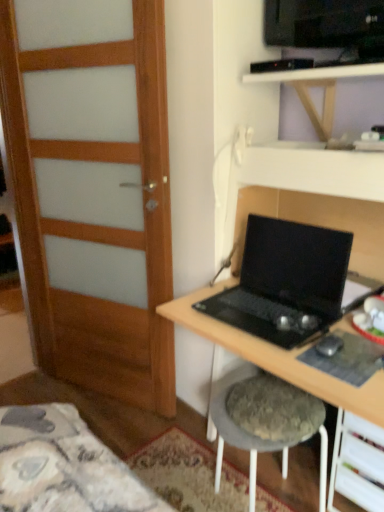
Question: Is fuzzy fabric stool at lower center looking in the opposite direction of black matte desk at center?

Choices:
 (A) no
 (B) yes

Answer: (B)

Question: Considering the relative sizes of fuzzy fabric stool at lower center and black matte desk at center in the image provided, is fuzzy fabric stool at lower center shorter than black matte desk at center?

Choices:
 (A) yes
 (B) no

Answer: (A)

Question: Can you confirm if fuzzy fabric stool at lower center is positioned to the right of black matte desk at center?

Choices:
 (A) no
 (B) yes

Answer: (A)

Question: Considering the relative sizes of fuzzy fabric stool at lower center and black matte desk at center in the image provided, is fuzzy fabric stool at lower center bigger than black matte desk at center?

Choices:
 (A) yes
 (B) no

Answer: (B)

Question: Does fuzzy fabric stool at lower center contain black matte desk at center?

Choices:
 (A) no
 (B) yes

Answer: (A)

Question: From a real-world perspective, relative to wooden door at left, is black matte desk at center vertically above or below?

Choices:
 (A) above
 (B) below

Answer: (B)

Question: Considering the positions of black matte desk at center and wooden door at left in the image, is black matte desk at center bigger or smaller than wooden door at left?

Choices:
 (A) small
 (B) big

Answer: (B)

Question: Considering the positions of point (311, 387) and point (132, 206), is point (311, 387) closer or farther from the camera than point (132, 206)?

Choices:
 (A) farther
 (B) closer

Answer: (B)

Question: Is black matte desk at center taller or shorter than wooden door at left?

Choices:
 (A) short
 (B) tall

Answer: (A)

Question: Relative to white plastic drawer at lower right, is black matte desk at center in front or behind?

Choices:
 (A) behind
 (B) front

Answer: (B)

Question: Looking at their shapes, would you say black matte desk at center is wider or thinner than white plastic drawer at lower right?

Choices:
 (A) wide
 (B) thin

Answer: (A)

Question: Looking at the image, does black matte desk at center seem bigger or smaller compared to white plastic drawer at lower right?

Choices:
 (A) big
 (B) small

Answer: (A)

Question: From the image's perspective, is black matte desk at center above or below white plastic drawer at lower right?

Choices:
 (A) below
 (B) above

Answer: (B)

Question: Is wooden at upper center to the left or to the right of black matte laptop at center in the image?

Choices:
 (A) left
 (B) right

Answer: (B)

Question: Is wooden at upper center in front of or behind black matte laptop at center in the image?

Choices:
 (A) behind
 (B) front

Answer: (A)